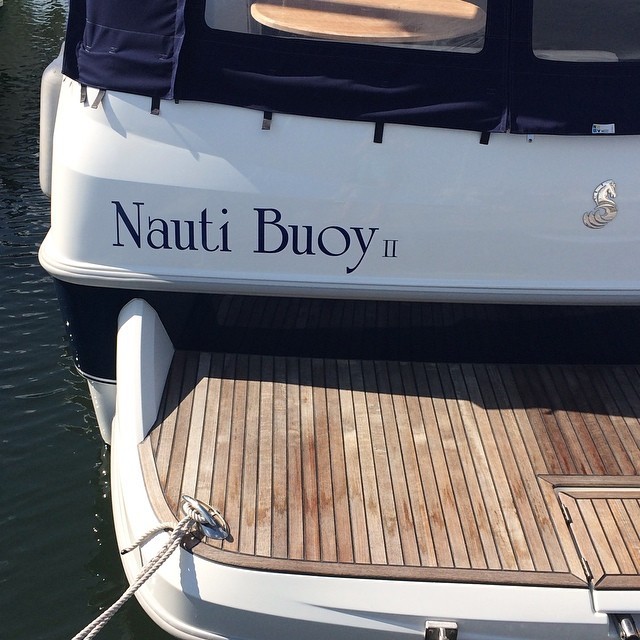
Locate an element on the screen. The height and width of the screenshot is (640, 640). wooden circular table is located at coordinates (358, 22).